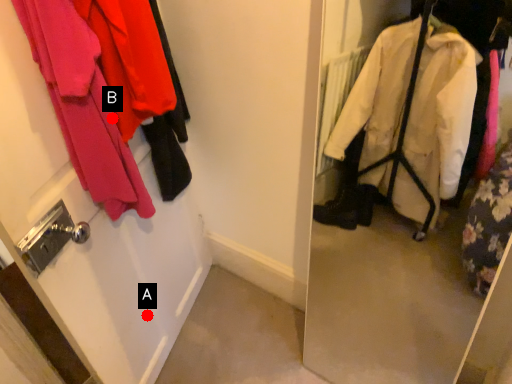
Question: Two points are circled on the image, labeled by A and B beside each circle. Which of the following is the closest to the observer?

Choices:
 (A) A is closer
 (B) B is closer

Answer: (B)